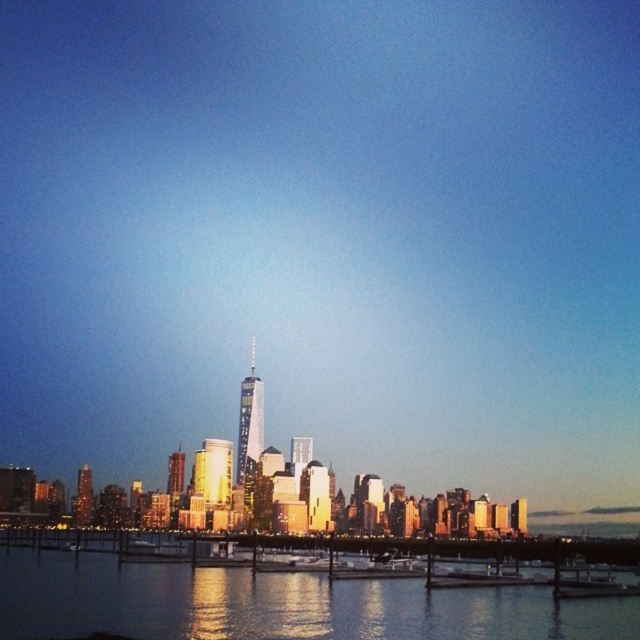
Question: Which object appears farthest from the camera in this image?

Choices:
 (A) shiny glass skyscraper at center
 (B) glistening water at lower center

Answer: (A)

Question: Is the position of glistening water at lower center less distant than that of shiny glass skyscraper at center?

Choices:
 (A) yes
 (B) no

Answer: (A)

Question: Does glistening water at lower center have a lesser width compared to shiny glass skyscraper at center?

Choices:
 (A) yes
 (B) no

Answer: (B)

Question: Which point appears closest to the camera in this image?

Choices:
 (A) (257, 444)
 (B) (570, 616)

Answer: (B)

Question: Which object appears farthest from the camera in this image?

Choices:
 (A) glistening water at lower center
 (B) shiny glass skyscraper at center

Answer: (B)

Question: Is glistening water at lower center below shiny glass skyscraper at center?

Choices:
 (A) yes
 (B) no

Answer: (A)